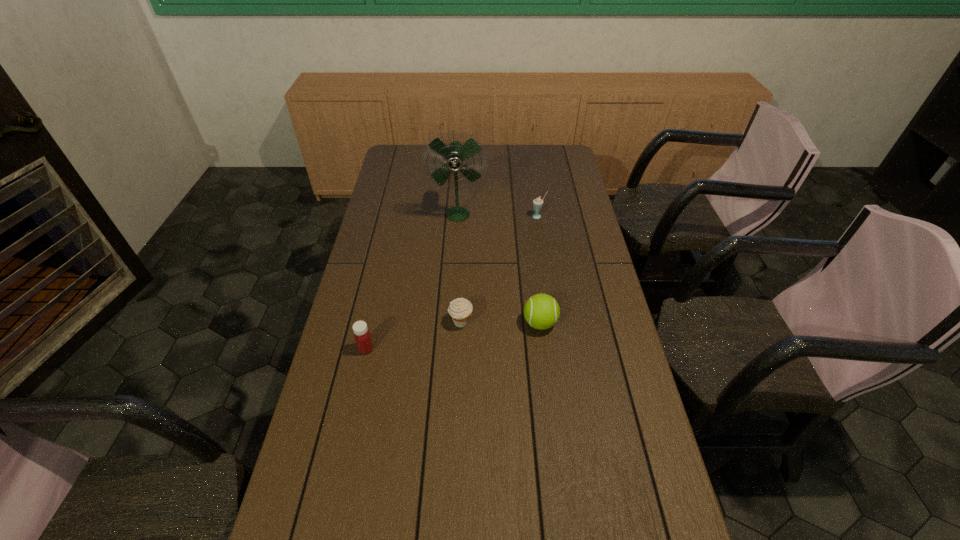
You are a GUI agent. You are given a task and a screenshot of the screen. Output one action in this format:
    pyautogui.click(x=<x>, y=<y>)
    Task: Click on the empty location between the leftmost object and the tennis ball
    This screenshot has height=540, width=960.
    Given the screenshot: What is the action you would take?
    pyautogui.click(x=453, y=336)

Locate which object is the second closest to the tennis ball. Please provide its 2D coordinates. Your answer should be formatted as a tuple, i.e. [(x, y)], where the tuple contains the x and y coordinates of a point satisfying the conditions above.

[(362, 336)]

Point out which object is positioned as the third nearest to the tallest object. Please provide its 2D coordinates. Your answer should be formatted as a tuple, i.e. [(x, y)], where the tuple contains the x and y coordinates of a point satisfying the conditions above.

[(541, 311)]